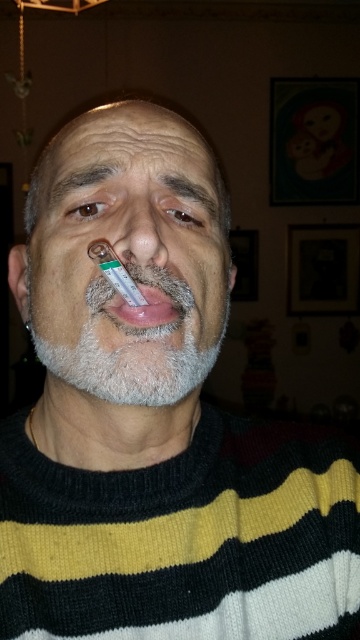
You are a photographer adjusting the lighting in the scene. You need to ensure that the point at coordinates point (137, 230) is well lit. Where exactly on the person should you focus the light to highlight the point?

The point (137, 230) corresponds to the smooth skin nose at center, so you should focus the light on the person nose to highlight that point.

Based on the scene description, which object is taller when comparing the smooth skin nose at center and the pink glossy lips at center?

The smooth skin nose at center is taller than the pink glossy lips at center.

You are a medical professional assessing the individual in the image. You need to take their temperature using a thermometer. The thermometer requires being placed 12 inches away from the nose to get an accurate reading. Can you determine if the smooth skin nose at center is within the required distance for an accurate reading?

The distance between the smooth skin nose at center and the viewer is 15.69 inches, which is farther than the required 12 inches. Therefore, the thermometer may not provide an accurate reading unless moved closer.